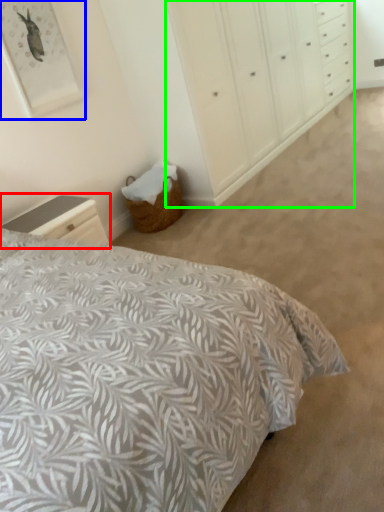
Question: Based on their relative distances, which object is nearer to nightstand (highlighted by a red box)? Choose from picture frame (highlighted by a blue box) and dresser (highlighted by a green box).

Choices:
 (A) picture frame
 (B) dresser

Answer: (A)